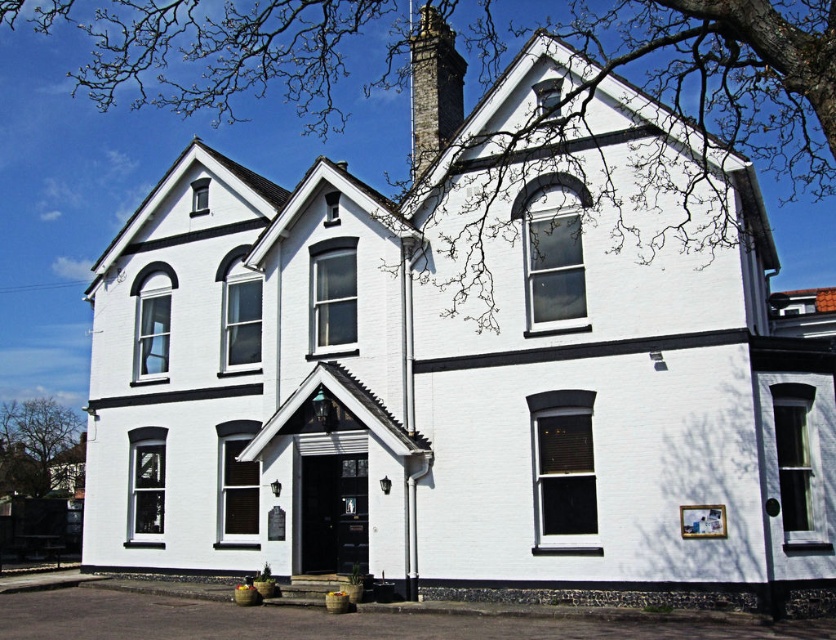
Does bare branches at upper center appear on the left side of bare branches at left?

Incorrect, bare branches at upper center is not on the left side of bare branches at left.

Consider the image. Which is more to the left, bare branches at upper center or bare branches at left?

From the viewer's perspective, bare branches at left appears more on the left side.

Which is behind, point (614, 36) or point (24, 451)?

Point (614, 36)

The image size is (836, 640). I want to click on bare branches at upper center, so click(x=236, y=56).

Is bare branches at upper center behind stone chimney at upper center?

Result: No, it is in front of stone chimney at upper center.

Between bare branches at upper center and stone chimney at upper center, which one is positioned lower?

Positioned lower is stone chimney at upper center.

Identify the location of bare branches at upper center. (236, 56).

Identify the location of bare branches at upper center. (236, 56).

Is point (432, 132) positioned in front of point (24, 461)?

Yes, it is.

Is stone chimney at upper center behind bare branches at left?

No, it is in front of bare branches at left.

Who is more distant from viewer, (x=426, y=140) or (x=51, y=403)?

Positioned behind is point (x=51, y=403).

The image size is (836, 640). I want to click on stone chimney at upper center, so click(432, 88).